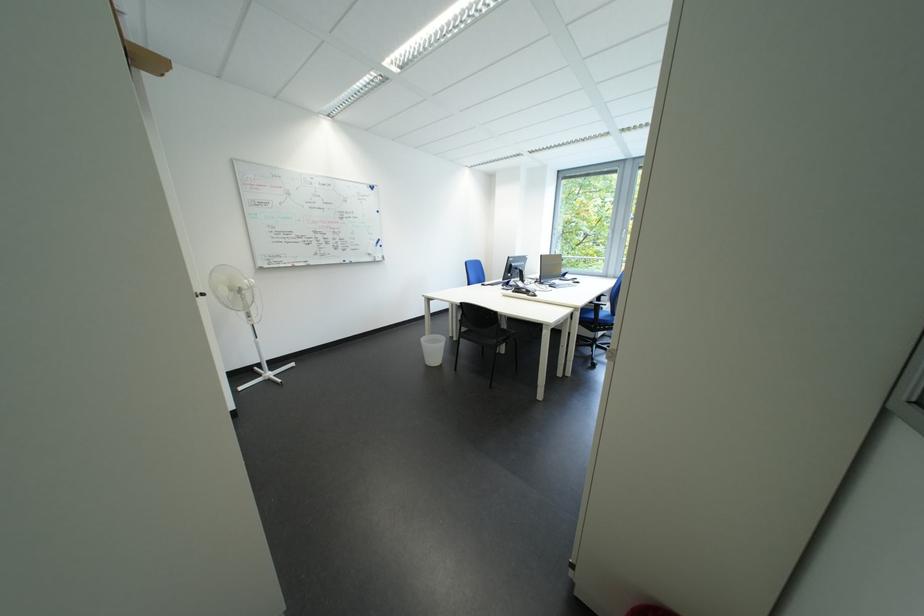
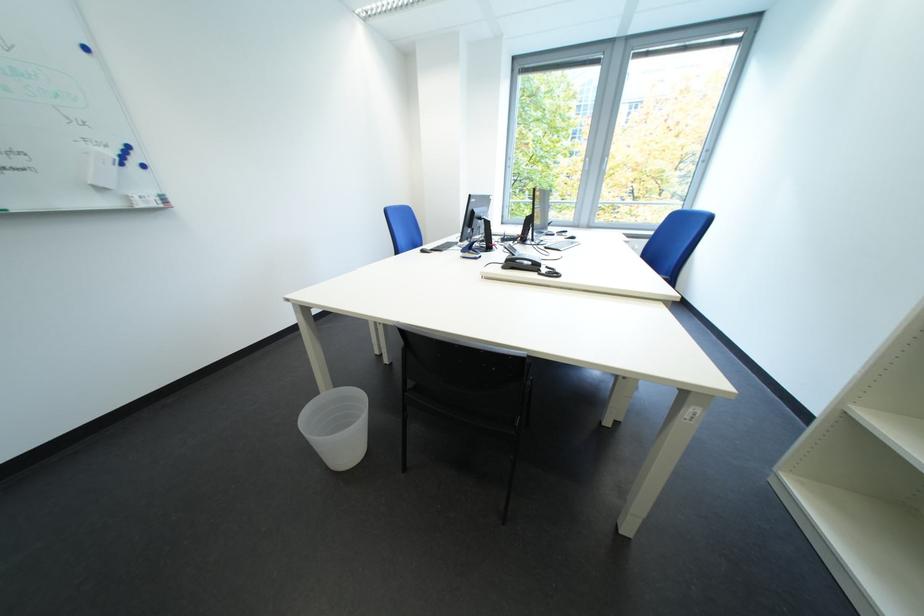
In the second image, find the point that corresponds to (x=579, y=278) in the first image.

(563, 232)